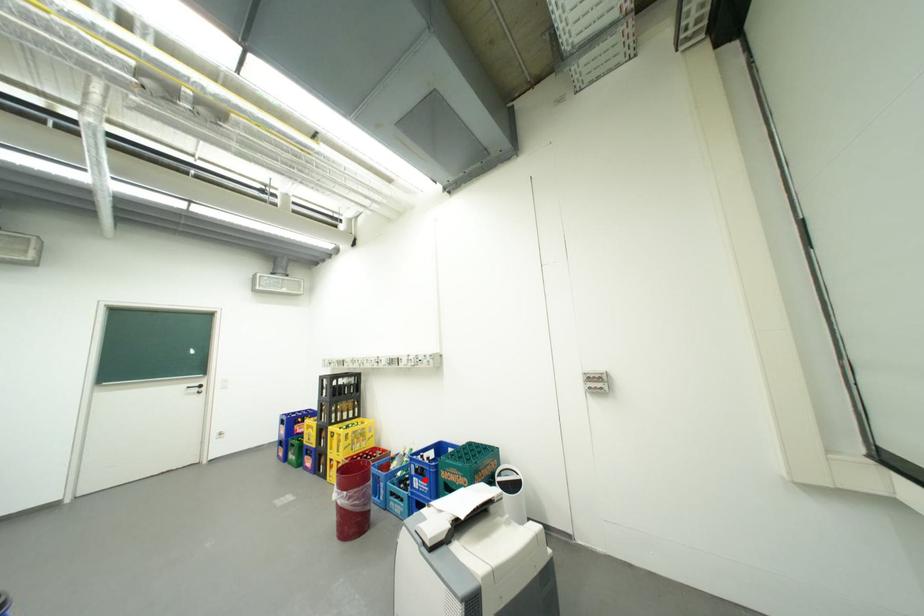
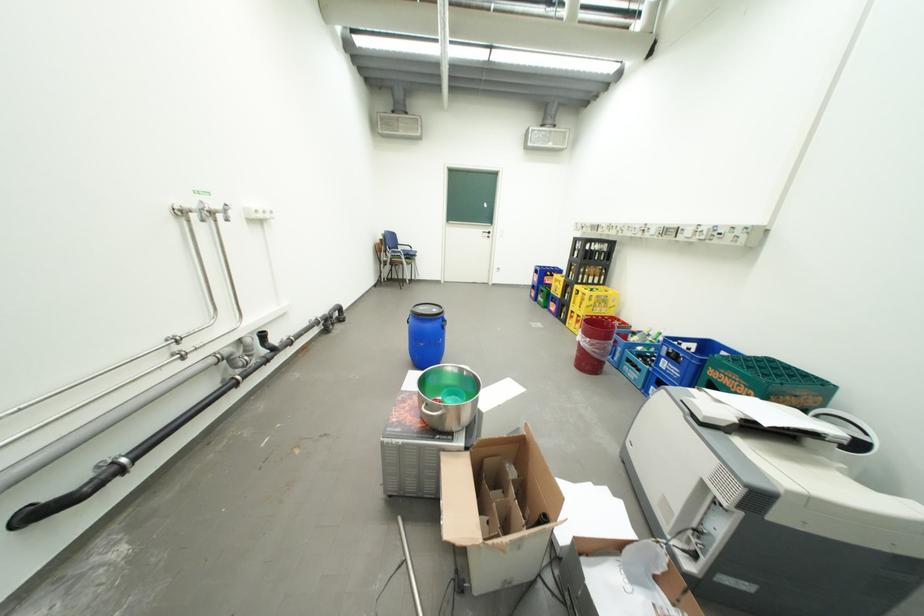
Where in the second image is the point corresponding to the highlighted location from the first image?

(674, 361)